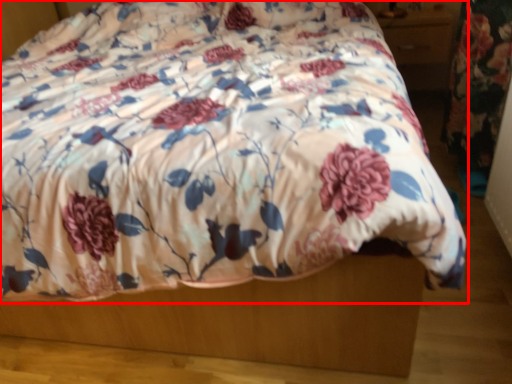
Question: Observing the image, what is the correct spatial positioning of bed (annotated by the red box) in reference to drawer?

Choices:
 (A) right
 (B) left

Answer: (B)